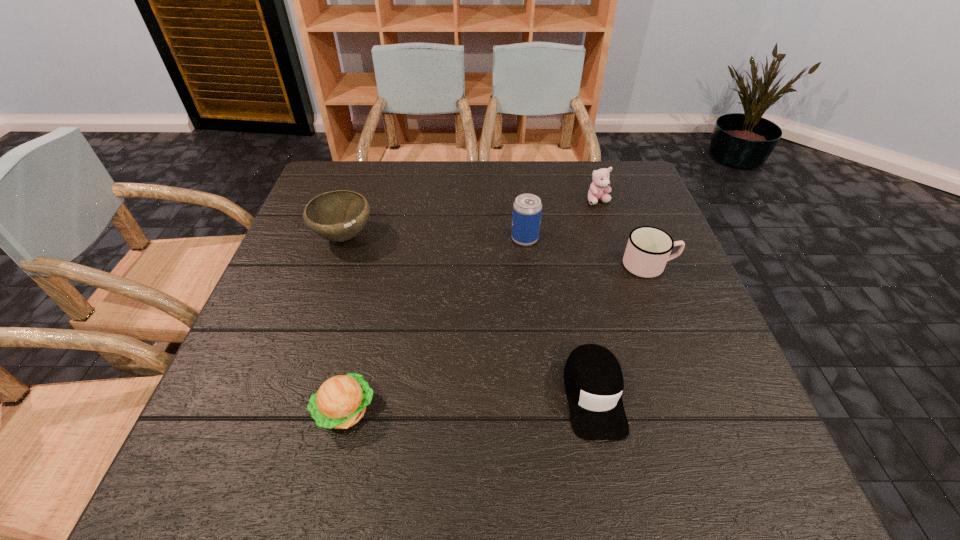
Find the location of a particular element. This screenshot has height=540, width=960. free point located 0.050m on the front-facing side of the cap is located at coordinates (609, 472).

Find the location of a particular element. The width and height of the screenshot is (960, 540). object situated at the far edge is located at coordinates (600, 184).

This screenshot has height=540, width=960. I want to click on hamburger at the near edge, so click(340, 402).

Image resolution: width=960 pixels, height=540 pixels. Identify the location of cap that is at the near edge. click(593, 379).

Identify the location of object that is at the left edge. This screenshot has height=540, width=960. (340, 215).

Locate an element on the screen. The width and height of the screenshot is (960, 540). teddy bear that is at the right edge is located at coordinates (600, 184).

The image size is (960, 540). Identify the location of mug that is at the right edge. (648, 250).

You are a GUI agent. You are given a task and a screenshot of the screen. Output one action in this format:
    pyautogui.click(x=<x>, y=<y>)
    Task: Click on the object that is at the far right corner
    
    Given the screenshot: What is the action you would take?
    pyautogui.click(x=600, y=184)

At what (x,y) coordinates should I click in order to perform the action: click on free space at the far edge of the desktop. Please return your answer as a coordinate pair (x, y). The image size is (960, 540). Looking at the image, I should click on (493, 195).

At what (x,y) coordinates should I click in order to perform the action: click on vacant position at the left edge of the desktop. Please return your answer as a coordinate pair (x, y). The image size is (960, 540). Looking at the image, I should click on (283, 273).